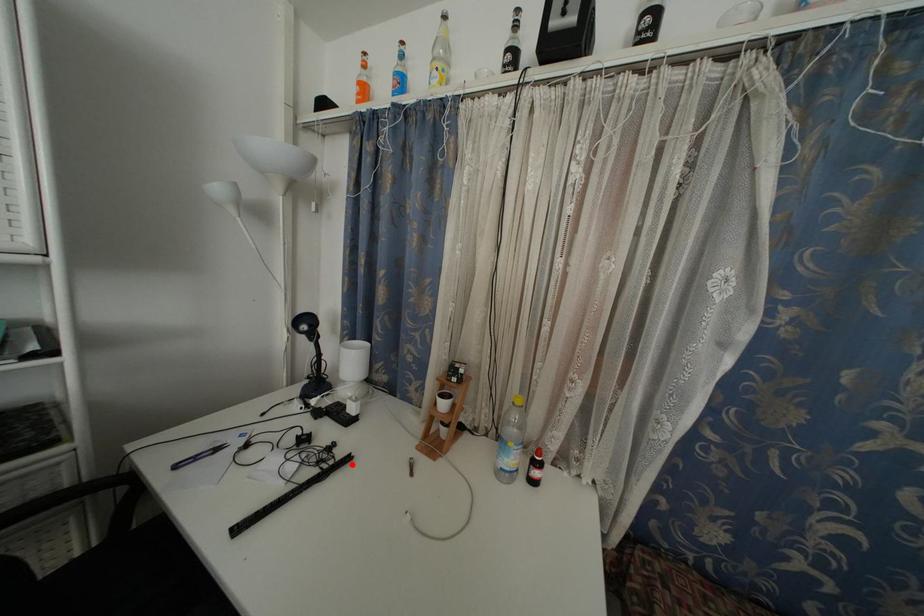
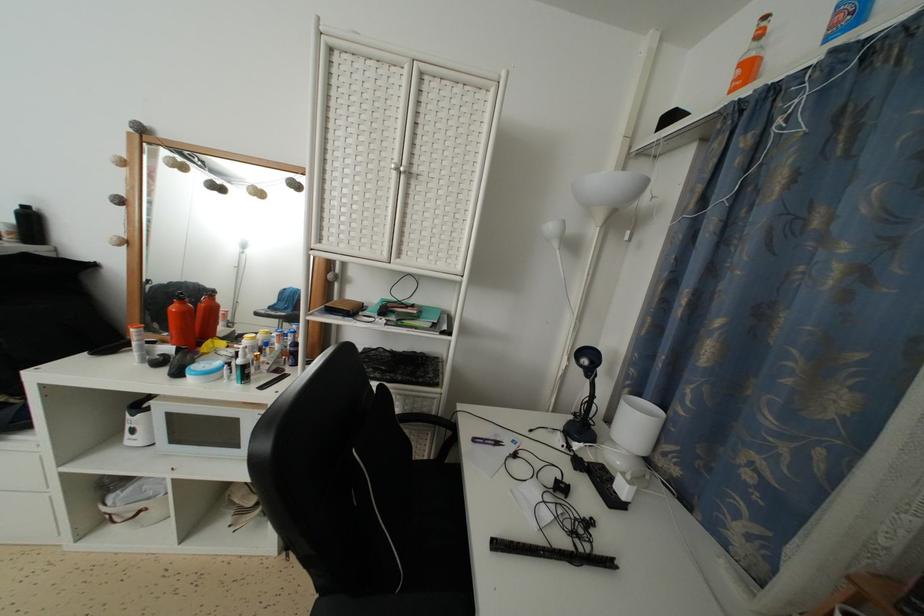
In the second image, find the point that corresponds to the highlighted location in the first image.

(614, 569)